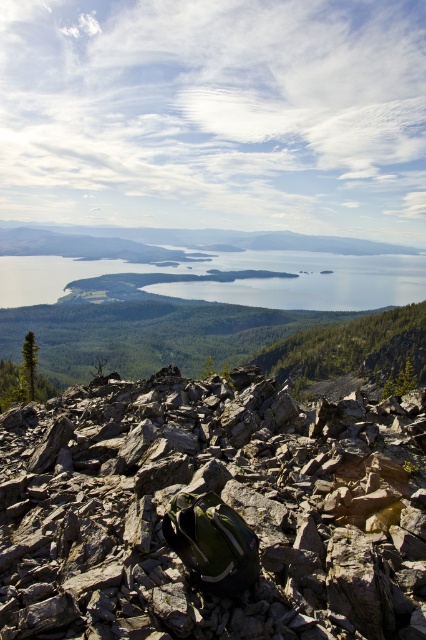
You are a hiker trying to navigate through the rugged terrain. You need to place your camping gear on a surface that can support heavy weight. Which object between the gray rocky boulder at center and the green textured hillside at center would be more suitable for this purpose?

The gray rocky boulder at center is more suitable for placing camping gear as it is a solid rock surface, whereas the green textured hillside at center consists of soil and vegetation which may not provide the same level of stability.

You are a hiker who has just reached the summit and wants to place your dark green backpack in a safe spot. According to the coordinates provided, where exactly is the gray rocky boulder at center located?

The gray rocky boulder at center is located at coordinates point [210,513].

You are a hiker trying to navigate the terrain. You see the gray rocky boulder at center and the green textured hillside at center. Which one is closer to you?

The gray rocky boulder at center is closer to the viewer than the green textured hillside at center.